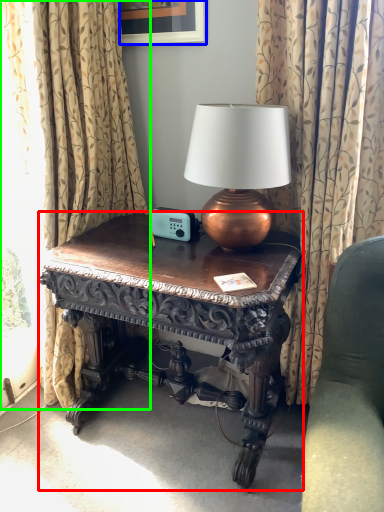
Question: Estimate the real-world distances between objects in this image. Which object is closer to table (highlighted by a red box), picture frame (highlighted by a blue box) or curtain (highlighted by a green box)?

Choices:
 (A) picture frame
 (B) curtain

Answer: (B)